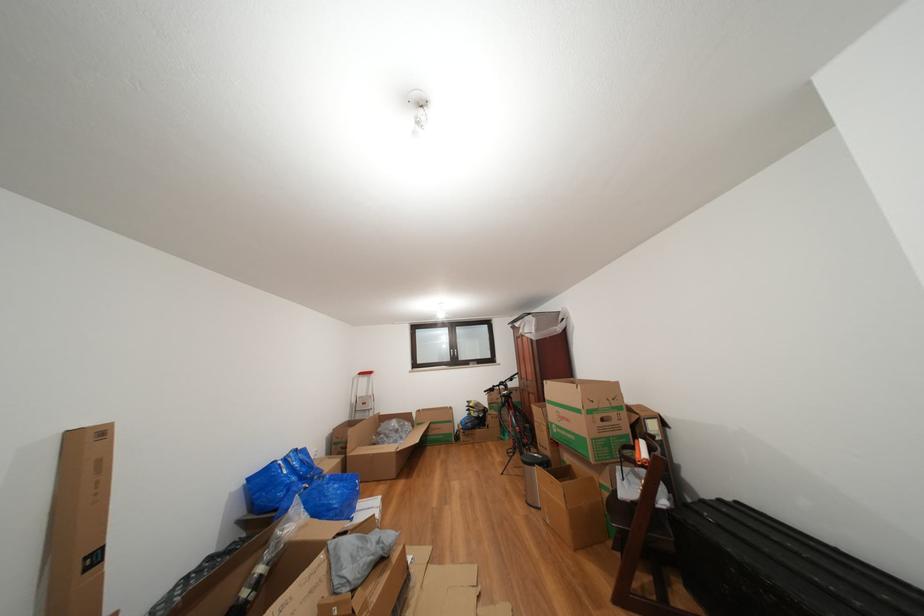
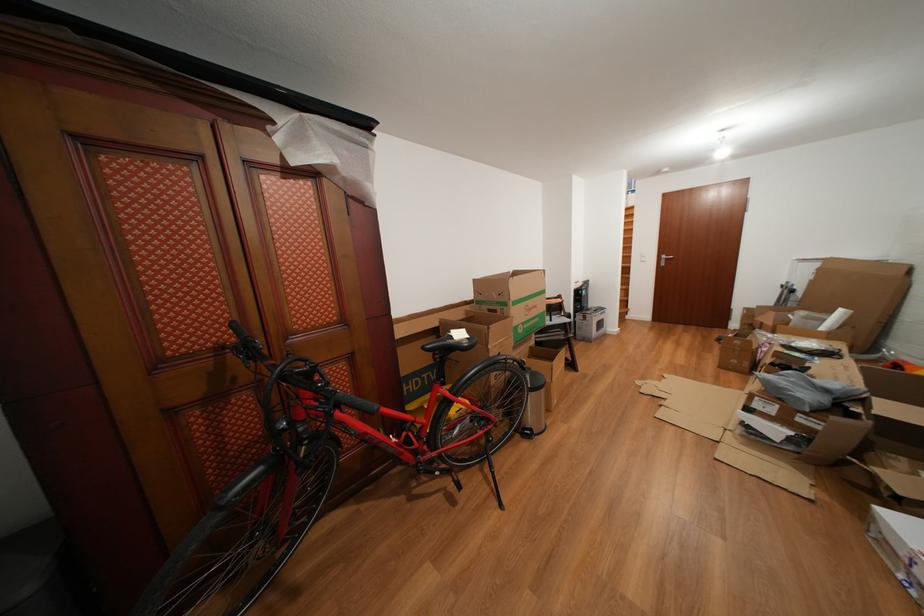
Locate, in the second image, the point that corresponds to point (576, 426) in the first image.

(543, 312)